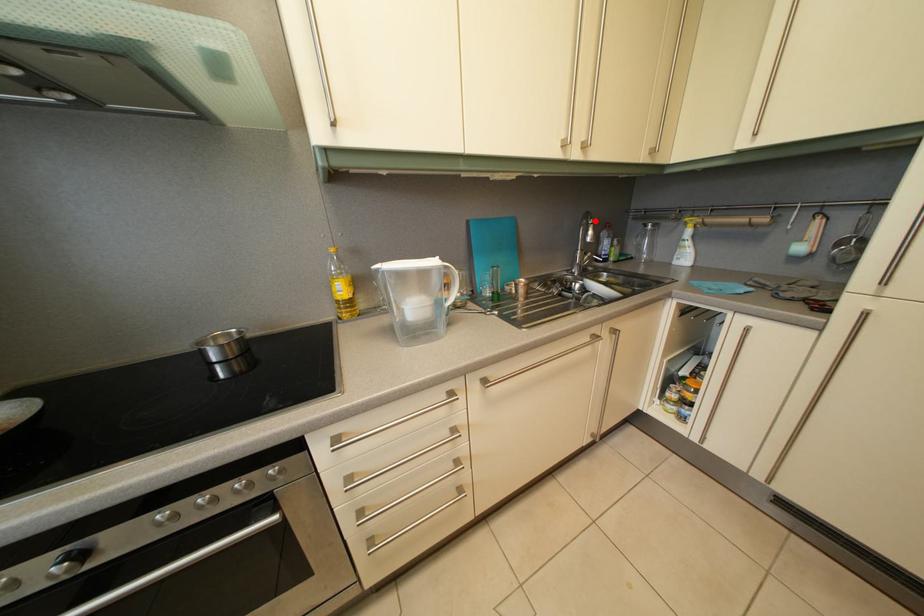
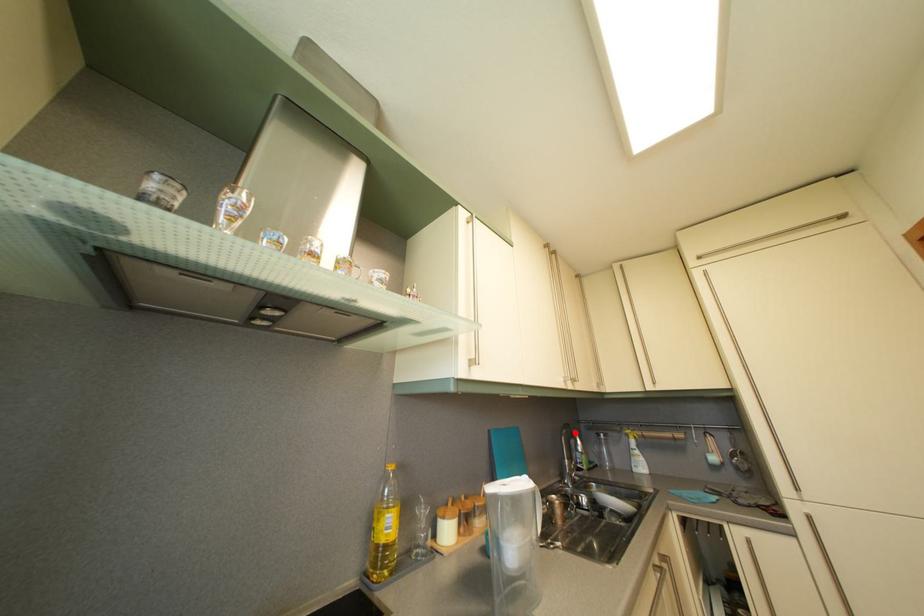
I am providing you with two images of the same scene from different viewpoints. A red point is marked on the first image and another point is marked on the second image. Is the red point in image1 aligned with the point shown in image2?

Yes